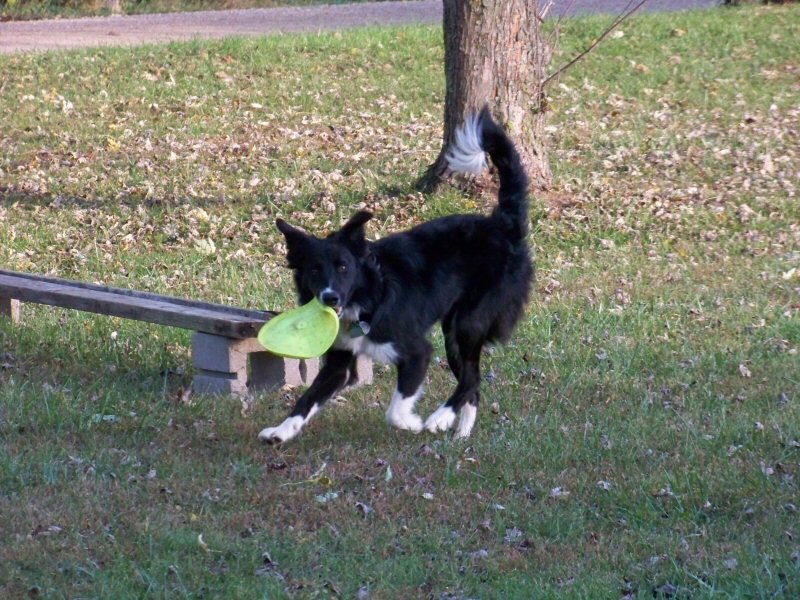
What are the coordinates of `bench` in the screenshot? It's located at (102, 300).